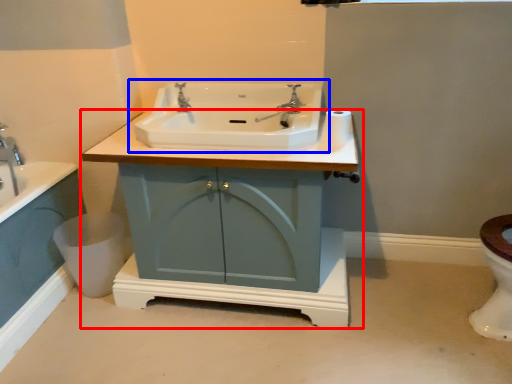
Question: Which object is closer to the camera taking this photo, bathroom cabinet (highlighted by a red box) or sink (highlighted by a blue box)?

Choices:
 (A) bathroom cabinet
 (B) sink

Answer: (A)